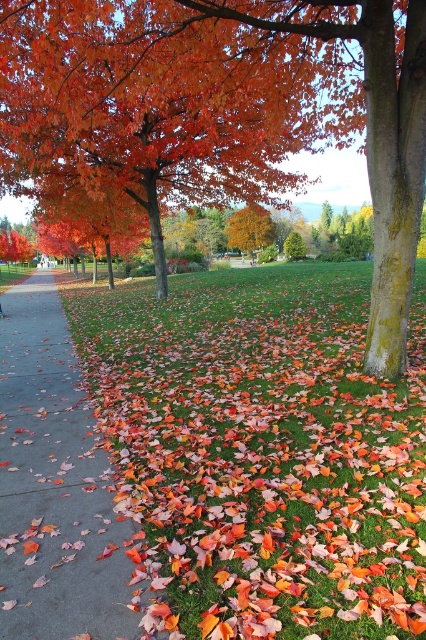
You are standing at the point marked as point (54,484). What is the object located exactly at this point?

The gray concrete sidewalk at lower left is located at point (54,484).

You are planning to take a photo of the gray concrete sidewalk at lower left and the orange glossy tree at center. Which object should you focus on first if you want to capture both in a single frame without moving the camera?

The gray concrete sidewalk at lower left is smaller than the orange glossy tree at center, so you should focus on the orange glossy tree at center first to ensure it fills the frame appropriately before adjusting for the smaller sidewalk.

You are a gardener who needs to trim the orange glossy tree at center so it doesn not block the gray concrete sidewalk at lower left. Based on the scene, will you need to adjust the height of the tree?

The gray concrete sidewalk at lower left is not as tall as orange glossy tree at center, so yes, the gardener will need to adjust the height of the orange glossy tree at center to prevent it from blocking the sidewalk.